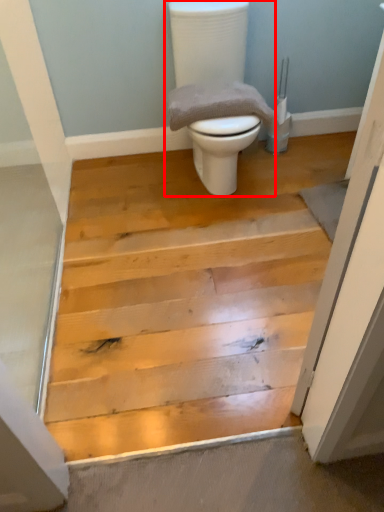
Question: From the image's perspective, what is the correct spatial relationship of toilet (annotated by the red box) in relation to material?

Choices:
 (A) below
 (B) above

Answer: (B)